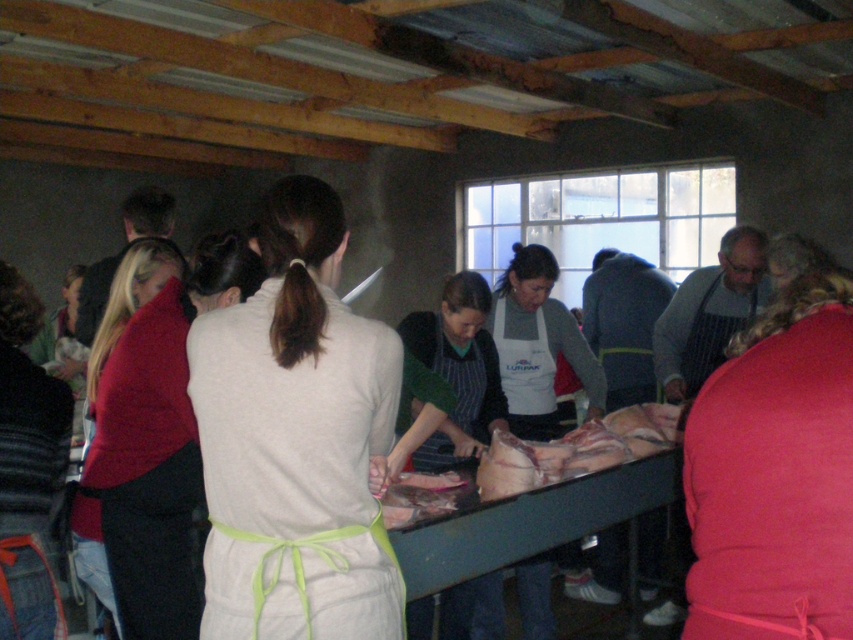
Question: Which point appears closest to the camera in this image?

Choices:
 (A) (834, 545)
 (B) (184, 634)

Answer: (A)

Question: Is green striped apron at center further to camera compared to pinkish raw meat at center?

Choices:
 (A) no
 (B) yes

Answer: (B)

Question: Can you confirm if matte red sweater at center is thinner than pink raw meat at center?

Choices:
 (A) yes
 (B) no

Answer: (B)

Question: Can you confirm if green plastic table at center is wider than pinkish raw meat at center?

Choices:
 (A) yes
 (B) no

Answer: (A)

Question: Which object is the closest to the light gray fabric apron at center?

Choices:
 (A) green plastic table at center
 (B) pink fabric at center
 (C) matte red sweater at center

Answer: (C)

Question: Which of the following is the closest to the observer?

Choices:
 (A) pinkish raw meat at center
 (B) green striped apron at center
 (C) pink fabric at center

Answer: (C)